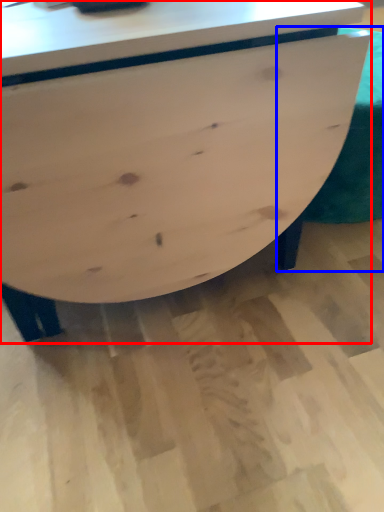
Question: Which point is further to the camera, table (highlighted by a red box) or swivel chair (highlighted by a blue box)?

Choices:
 (A) table
 (B) swivel chair

Answer: (B)